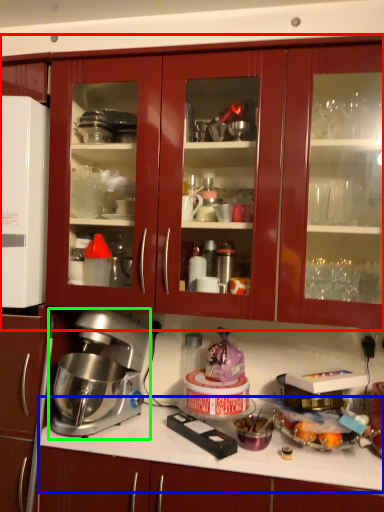
Question: Considering the real-world distances, which object is farthest from cabinetry (highlighted by a red box)? countertop (highlighted by a blue box) or mixer (highlighted by a green box)?

Choices:
 (A) countertop
 (B) mixer

Answer: (A)